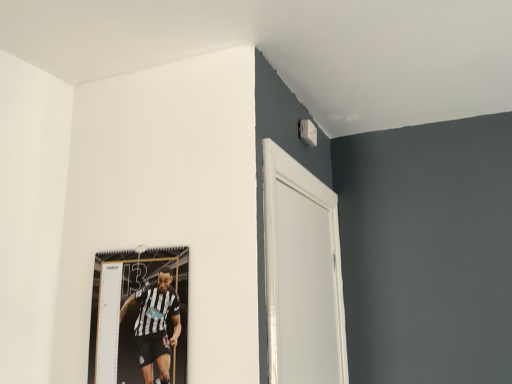
Question: Is black and white jersey at upper left taller than white glossy door at upper right?

Choices:
 (A) no
 (B) yes

Answer: (A)

Question: Is black and white jersey at upper left completely or partially outside of white glossy door at upper right?

Choices:
 (A) no
 (B) yes

Answer: (B)

Question: From the image's perspective, would you say black and white jersey at upper left is shown under white glossy door at upper right?

Choices:
 (A) yes
 (B) no

Answer: (A)

Question: Can you confirm if black and white jersey at upper left is positioned to the left of white glossy door at upper right?

Choices:
 (A) no
 (B) yes

Answer: (B)

Question: Can you confirm if black and white jersey at upper left is thinner than white glossy door at upper right?

Choices:
 (A) yes
 (B) no

Answer: (A)

Question: Does black and white jersey at upper left have a larger size compared to white glossy door at upper right?

Choices:
 (A) no
 (B) yes

Answer: (A)

Question: Does white glossy door at upper right have a greater height compared to black and white jersey at upper left?

Choices:
 (A) no
 (B) yes

Answer: (B)

Question: Does white glossy door at upper right lie behind black and white jersey at upper left?

Choices:
 (A) yes
 (B) no

Answer: (B)

Question: Are white glossy door at upper right and black and white jersey at upper left far apart?

Choices:
 (A) yes
 (B) no

Answer: (B)

Question: Is white glossy door at upper right outside black and white jersey at upper left?

Choices:
 (A) yes
 (B) no

Answer: (A)

Question: Considering the relative sizes of white glossy door at upper right and black and white jersey at upper left in the image provided, is white glossy door at upper right shorter than black and white jersey at upper left?

Choices:
 (A) no
 (B) yes

Answer: (A)

Question: Can black and white jersey at upper left be found inside white glossy door at upper right?

Choices:
 (A) yes
 (B) no

Answer: (B)

Question: Do you think white glossy door at upper right is within black and white jersey at upper left, or outside of it?

Choices:
 (A) inside
 (B) outside

Answer: (B)